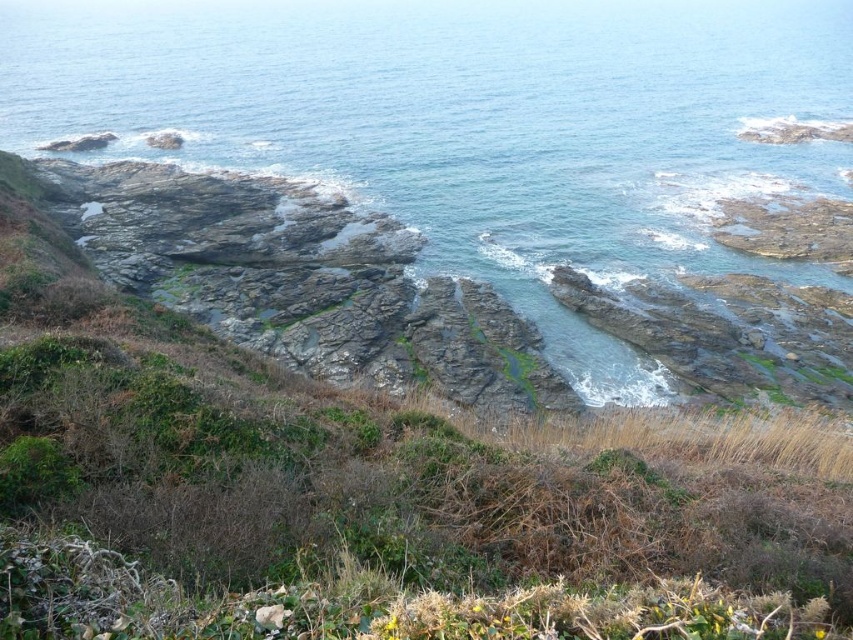
What do you see at coordinates (471, 125) in the screenshot? This screenshot has width=853, height=640. I see `clear blue water at center` at bounding box center [471, 125].

Which is behind, point (773, 189) or point (267, 326)?

The point (773, 189) is behind.

At what (x,y) coordinates should I click in order to perform the action: click on clear blue water at center. Please return your answer as a coordinate pair (x, y). Looking at the image, I should click on (471, 125).